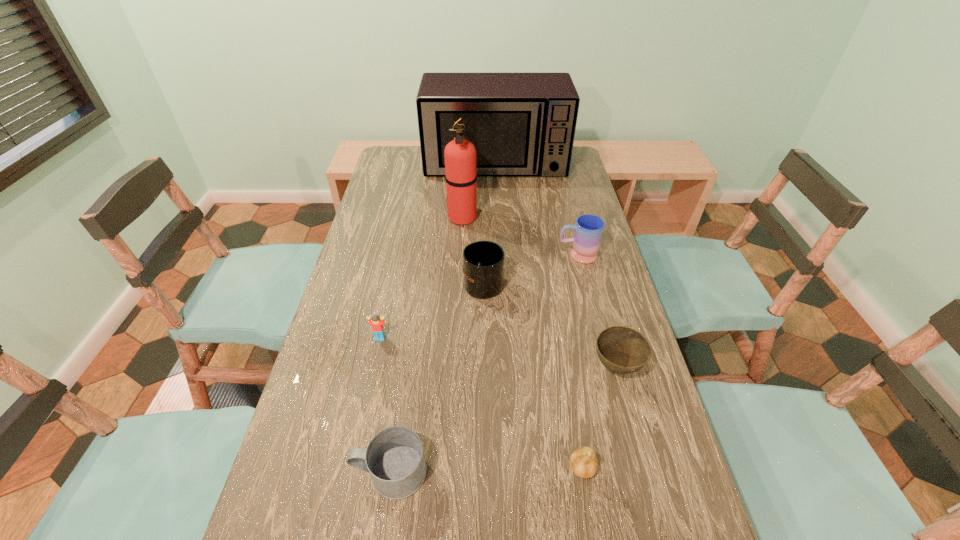
Find the location of a particular element. free location located 0.060m on the back of the pear is located at coordinates (575, 429).

Where is `vacant position located on the side of the shortest mug with the handle`? The image size is (960, 540). vacant position located on the side of the shortest mug with the handle is located at coordinates (294, 472).

Find the location of a particular element. Image resolution: width=960 pixels, height=540 pixels. free spot located on the side of the shortest mug with the handle is located at coordinates (279, 472).

The image size is (960, 540). Find the location of `vacant space situated 0.150m on the side of the shortest mug with the handle`. vacant space situated 0.150m on the side of the shortest mug with the handle is located at coordinates (279, 472).

Identify the location of free region located on the left of the bowl. (468, 368).

Locate an element on the screen. The image size is (960, 540). vacant space located on the face of the Lego is located at coordinates (346, 501).

Locate an element on the screen. object that is at the far edge is located at coordinates (522, 124).

This screenshot has width=960, height=540. In order to click on mug positioned at the left edge in this screenshot , I will do `click(394, 458)`.

In order to click on Lego positioned at the left edge in this screenshot , I will do `click(377, 325)`.

This screenshot has width=960, height=540. What are the coordinates of `microwave_oven located in the right edge section of the desktop` in the screenshot? It's located at (522, 124).